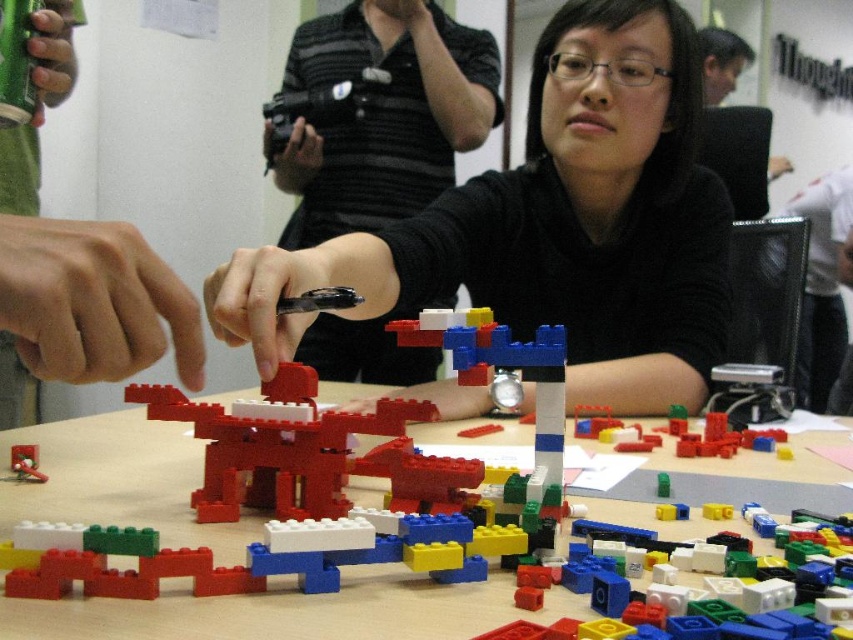
Question: Which is farther from the smooth red toy at center?

Choices:
 (A) black mesh chair at right
 (B) black matte shirt at center

Answer: (A)

Question: Which of the following is the closest to the observer?

Choices:
 (A) (94, 637)
 (B) (403, 252)

Answer: (A)

Question: Can you confirm if black matte shirt at center is positioned below brick-like plastic blocks at center?

Choices:
 (A) no
 (B) yes

Answer: (A)

Question: Does matte black camera at upper center have a smaller size compared to brick-like plastic blocks at center?

Choices:
 (A) yes
 (B) no

Answer: (B)

Question: Does black matte shirt at center lie behind matte black hand at lower left?

Choices:
 (A) yes
 (B) no

Answer: (B)

Question: Which object is farther from the camera taking this photo?

Choices:
 (A) matte black hand at lower left
 (B) smooth red toy at center
 (C) multicolored plastic blocks at center

Answer: (A)